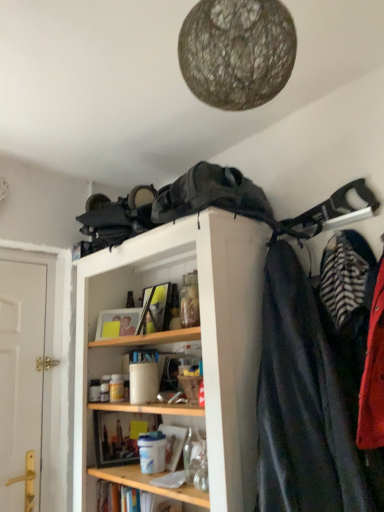
Question: Is point (324, 460) closer or farther from the camera than point (215, 380)?

Choices:
 (A) closer
 (B) farther

Answer: (A)

Question: From the image's perspective, relative to wooden shelf at upper center, is striped fabric coat at right, placed as the second cloak when sorted from left to right, above or below?

Choices:
 (A) below
 (B) above

Answer: (B)

Question: Estimate the real-world distances between objects in this image. Which object is closer to the wooden shelf at lower center?

Choices:
 (A) wooden shelf at upper center
 (B) dark gray fabric backpack at upper center, the 2th cloak from the right
 (C) striped fabric coat at right, the 2th cloak positioned from the top
 (D) white wooden door at left

Answer: (A)

Question: Considering the real-world distances, which object is farthest from the wooden shelf at lower center?

Choices:
 (A) white wooden door at left
 (B) wooden shelf at upper center
 (C) striped fabric coat at right, the first cloak in the right-to-left sequence
 (D) dark gray fabric backpack at upper center, placed as the 1th cloak when sorted from left to right

Answer: (D)